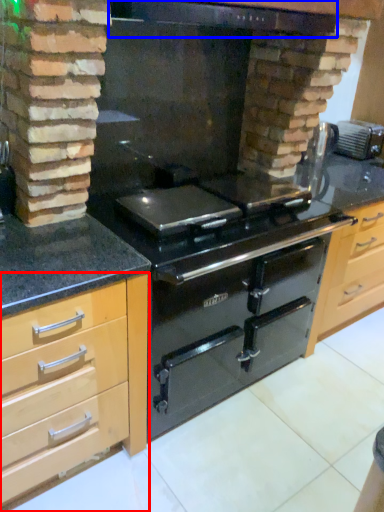
Question: Which point is further to the camera, cabinetry (highlighted by a red box) or exhaust hood (highlighted by a blue box)?

Choices:
 (A) cabinetry
 (B) exhaust hood

Answer: (B)